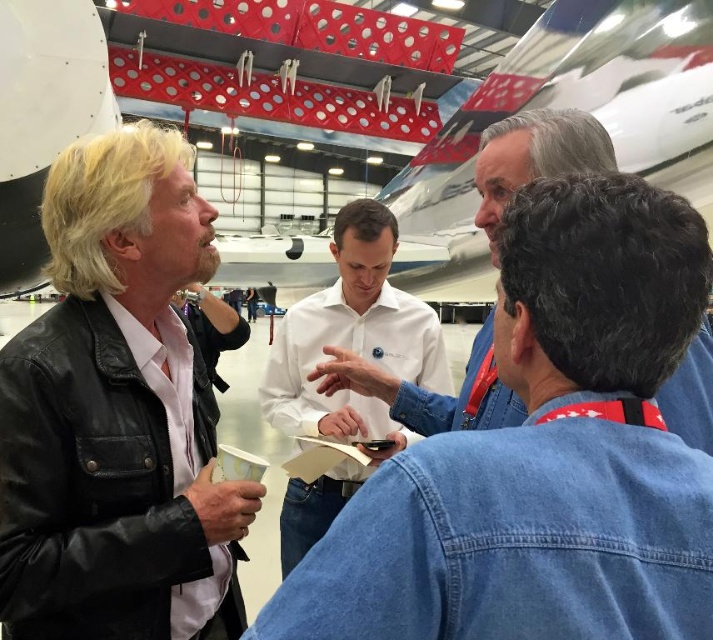
Question: Which of the following is the farthest from the observer?

Choices:
 (A) (297, 508)
 (B) (327, 385)

Answer: (A)

Question: Can you confirm if white glossy airplane at upper center is smaller than denim shirt at center?

Choices:
 (A) no
 (B) yes

Answer: (A)

Question: Does denim jacket at center lie behind denim shirt at center?

Choices:
 (A) no
 (B) yes

Answer: (A)

Question: Which point appears farthest from the camera in this image?

Choices:
 (A) (307, 602)
 (B) (339, 508)
 (C) (506, 134)
 (D) (118, 508)

Answer: (B)

Question: Can you confirm if black leather jacket at left is positioned to the left of denim shirt at center?

Choices:
 (A) yes
 (B) no

Answer: (A)

Question: Which object is positioned farthest from the denim jacket at center?

Choices:
 (A) white shirt at center
 (B) white glossy airplane at upper center
 (C) black leather jacket at left
 (D) denim shirt at center

Answer: (B)